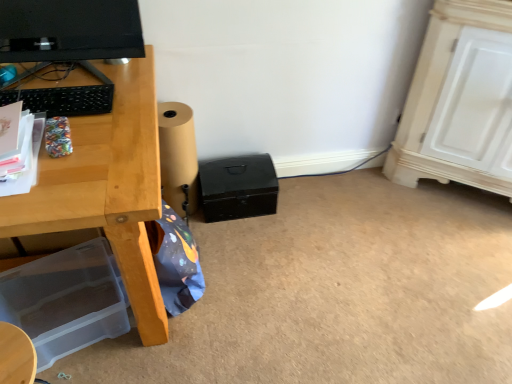
Question: Is matte black monitor at upper left located within brown paper roll at lower center?

Choices:
 (A) no
 (B) yes

Answer: (A)

Question: From the image's perspective, does brown paper roll at lower center appear higher than matte black monitor at upper left?

Choices:
 (A) no
 (B) yes

Answer: (A)

Question: From a real-world perspective, is brown paper roll at lower center positioned under matte black monitor at upper left based on gravity?

Choices:
 (A) no
 (B) yes

Answer: (B)

Question: Can you confirm if brown paper roll at lower center is positioned to the right of matte black monitor at upper left?

Choices:
 (A) no
 (B) yes

Answer: (B)

Question: Does brown paper roll at lower center appear on the left side of matte black monitor at upper left?

Choices:
 (A) no
 (B) yes

Answer: (A)

Question: Visually, is black matte box at center, the 1th box when ordered from back to front, positioned to the left or to the right of brown paper roll at lower center?

Choices:
 (A) right
 (B) left

Answer: (A)

Question: From the image's perspective, relative to brown paper roll at lower center, is black matte box at center, the 1th box positioned from the top, above or below?

Choices:
 (A) below
 (B) above

Answer: (A)

Question: Which is correct: black matte box at center, the 1th box positioned from the top, is inside brown paper roll at lower center, or outside of it?

Choices:
 (A) inside
 (B) outside

Answer: (B)

Question: Relative to brown paper roll at lower center, is black matte box at center, the 1th box positioned from the top, in front or behind?

Choices:
 (A) behind
 (B) front

Answer: (A)

Question: In terms of height, does transparent plastic storage box at lower left, the 2th box viewed from the right, look taller or shorter compared to brown paper roll at lower center?

Choices:
 (A) short
 (B) tall

Answer: (A)

Question: Looking at the image, does transparent plastic storage box at lower left, the 2th box viewed from the right, seem bigger or smaller compared to brown paper roll at lower center?

Choices:
 (A) small
 (B) big

Answer: (B)

Question: Choose the correct answer: Is transparent plastic storage box at lower left, the second box viewed from the top, inside brown paper roll at lower center or outside it?

Choices:
 (A) inside
 (B) outside

Answer: (B)

Question: From a real-world perspective, relative to brown paper roll at lower center, is transparent plastic storage box at lower left, which ranks as the second box in back-to-front order, vertically above or below?

Choices:
 (A) above
 (B) below

Answer: (B)

Question: From a real-world perspective, is brown paper roll at lower center physically located above or below black matte box at center, which is counted as the 2th box, starting from the bottom?

Choices:
 (A) below
 (B) above

Answer: (B)

Question: From the image's perspective, relative to black matte box at center, the first box from the right, is brown paper roll at lower center above or below?

Choices:
 (A) below
 (B) above

Answer: (B)